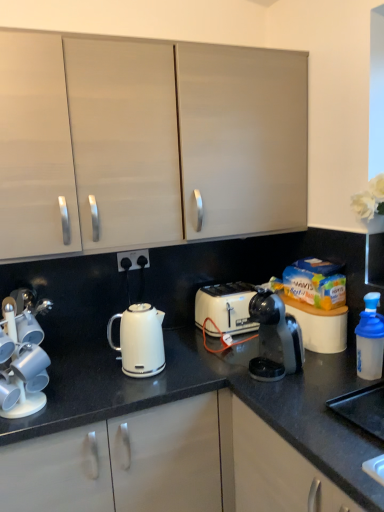
Question: Can you confirm if white glossy kettle at center is smaller than blue translucent bottle at right?

Choices:
 (A) no
 (B) yes

Answer: (A)

Question: Is white glossy kettle at center to the left of blue translucent bottle at right from the viewer's perspective?

Choices:
 (A) yes
 (B) no

Answer: (A)

Question: Is white glossy kettle at center shorter than blue translucent bottle at right?

Choices:
 (A) no
 (B) yes

Answer: (A)

Question: From the image's perspective, is white glossy kettle at center below blue translucent bottle at right?

Choices:
 (A) yes
 (B) no

Answer: (A)

Question: Is white glossy kettle at center at the right side of blue translucent bottle at right?

Choices:
 (A) yes
 (B) no

Answer: (B)

Question: Is white glossy kettle at center bigger or smaller than blue translucent bottle at right?

Choices:
 (A) big
 (B) small

Answer: (A)

Question: Is white glossy kettle at center in front of or behind blue translucent bottle at right in the image?

Choices:
 (A) front
 (B) behind

Answer: (B)

Question: Is white glossy kettle at center wider or thinner than blue translucent bottle at right?

Choices:
 (A) thin
 (B) wide

Answer: (B)

Question: In the image, is white glossy kettle at center on the left side or the right side of blue translucent bottle at right?

Choices:
 (A) left
 (B) right

Answer: (A)

Question: Considering the positions of blue translucent bottle at right and black plastic coffee maker at center in the image, is blue translucent bottle at right taller or shorter than black plastic coffee maker at center?

Choices:
 (A) short
 (B) tall

Answer: (A)

Question: Would you say blue translucent bottle at right is inside or outside black plastic coffee maker at center?

Choices:
 (A) inside
 (B) outside

Answer: (B)

Question: Is point click(360, 317) positioned closer to the camera than point click(264, 309)?

Choices:
 (A) closer
 (B) farther

Answer: (B)

Question: In the image, is blue translucent bottle at right positioned in front of or behind black plastic coffee maker at center?

Choices:
 (A) front
 (B) behind

Answer: (B)

Question: Considering the relative positions of white glossy cup holder at left and white glossy kettle at center in the image provided, is white glossy cup holder at left to the left or to the right of white glossy kettle at center?

Choices:
 (A) right
 (B) left

Answer: (B)

Question: Considering the positions of white glossy cup holder at left and white glossy kettle at center in the image, is white glossy cup holder at left bigger or smaller than white glossy kettle at center?

Choices:
 (A) small
 (B) big

Answer: (A)